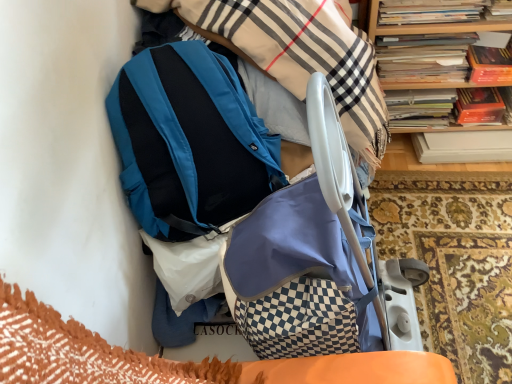
Question: Is teal matte backpack at upper center bigger than hardcover books at upper right, placed as the 2th book when sorted from front to back?

Choices:
 (A) no
 (B) yes

Answer: (B)

Question: From a real-world perspective, is teal matte backpack at upper center positioned over hardcover books at upper right, which is the first book from back to front, based on gravity?

Choices:
 (A) yes
 (B) no

Answer: (A)

Question: From a real-world perspective, is teal matte backpack at upper center physically below hardcover books at upper right, which is the first book from back to front?

Choices:
 (A) no
 (B) yes

Answer: (A)

Question: Is there a large distance between teal matte backpack at upper center and hardcover books at upper right, which is the first book from back to front?

Choices:
 (A) yes
 (B) no

Answer: (B)

Question: Is teal matte backpack at upper center facing away from hardcover books at upper right, which is the first book from back to front?

Choices:
 (A) no
 (B) yes

Answer: (A)

Question: Does teal matte backpack at upper center come in front of hardcover books at upper right, placed as the 2th book when sorted from front to back?

Choices:
 (A) no
 (B) yes

Answer: (B)

Question: From a real-world perspective, is wooden bookcase at upper right on hardcover book at upper right, which ranks as the 2th book in back-to-front order?

Choices:
 (A) yes
 (B) no

Answer: (B)

Question: Could you tell me if wooden bookcase at upper right is turned towards hardcover book at upper right, which ranks as the 2th book in back-to-front order?

Choices:
 (A) no
 (B) yes

Answer: (B)

Question: Are wooden bookcase at upper right and hardcover book at upper right, which ranks as the 2th book in back-to-front order, beside each other?

Choices:
 (A) yes
 (B) no

Answer: (A)

Question: Does wooden bookcase at upper right have a greater width compared to hardcover book at upper right, positioned as the 1th book in front-to-back order?

Choices:
 (A) yes
 (B) no

Answer: (A)

Question: Does wooden bookcase at upper right have a lesser height compared to hardcover book at upper right, which ranks as the 2th book in back-to-front order?

Choices:
 (A) yes
 (B) no

Answer: (B)

Question: Considering the relative sizes of wooden bookcase at upper right and hardcover book at upper right, which ranks as the 2th book in back-to-front order, in the image provided, is wooden bookcase at upper right bigger than hardcover book at upper right, which ranks as the 2th book in back-to-front order,?

Choices:
 (A) yes
 (B) no

Answer: (A)

Question: From the image's perspective, is hardcover book at upper right, which ranks as the 2th book in back-to-front order, below teal matte backpack at upper center?

Choices:
 (A) no
 (B) yes

Answer: (A)